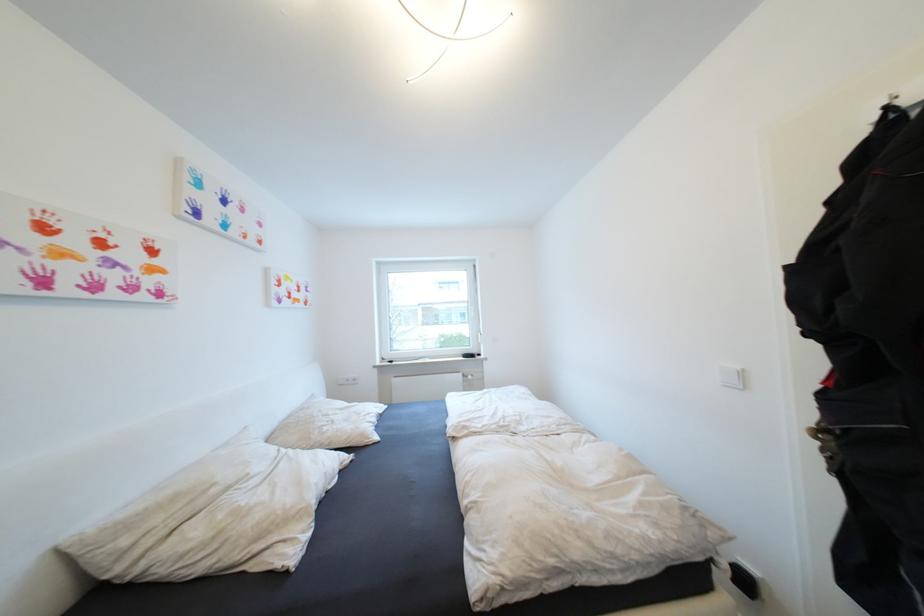
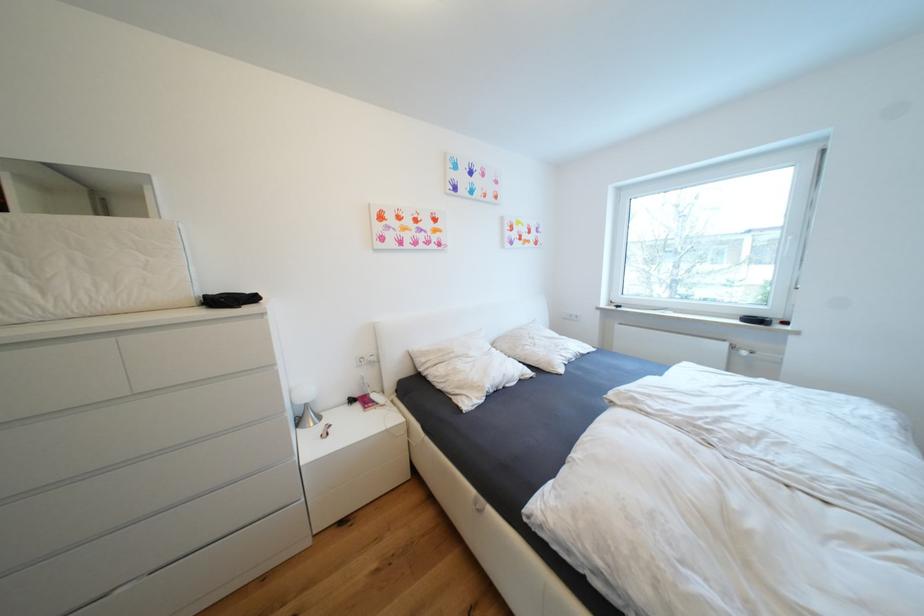
Locate, in the second image, the point that corresponds to [468,376] in the first image.

(733, 346)